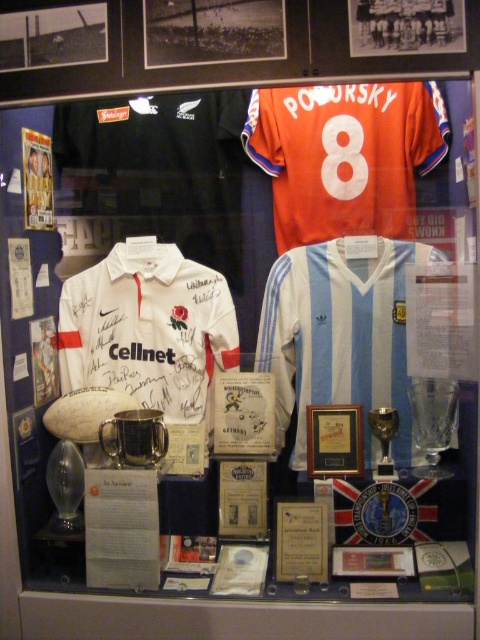
Question: Which point is closer to the camera?

Choices:
 (A) (322, 552)
 (B) (324, 125)
 (C) (326, 131)
 (D) (382, 458)

Answer: (A)

Question: Can you confirm if orange fabric number at upper center is positioned to the right of gold metallic trophy at center?

Choices:
 (A) no
 (B) yes

Answer: (A)

Question: Considering the relative positions of white matte jersey at center and orange fabric number at upper center in the image provided, where is white matte jersey at center located with respect to orange fabric number at upper center?

Choices:
 (A) below
 (B) above

Answer: (A)

Question: Which object appears closest to the camera in this image?

Choices:
 (A) white matte jersey at center
 (B) white striped jersey at center

Answer: (B)

Question: Which of these objects is positioned closest to the white striped jersey at center?

Choices:
 (A) matte gold plaque at center
 (B) gold metallic trophy at center

Answer: (B)

Question: In this image, where is orange jersey at upper center located relative to gold metallic trophy at center?

Choices:
 (A) left
 (B) right

Answer: (A)